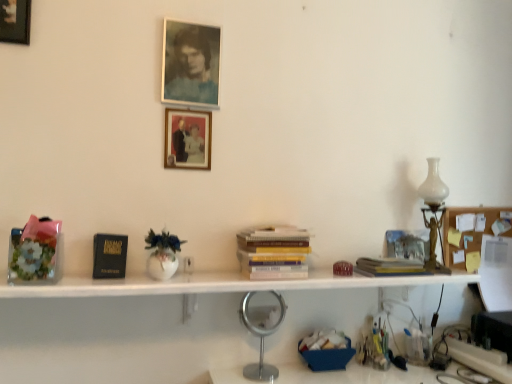
Find the location of a particular element. free space to the left of hardcover book at center, the second book from the left is located at coordinates (347, 276).